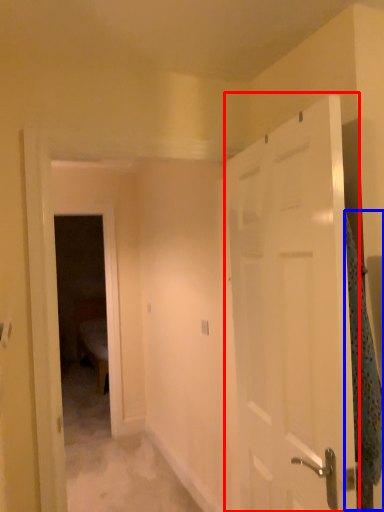
Question: Which object appears farthest to the camera in this image, door (highlighted by a red box) or blanket (highlighted by a blue box)?

Choices:
 (A) door
 (B) blanket

Answer: (B)